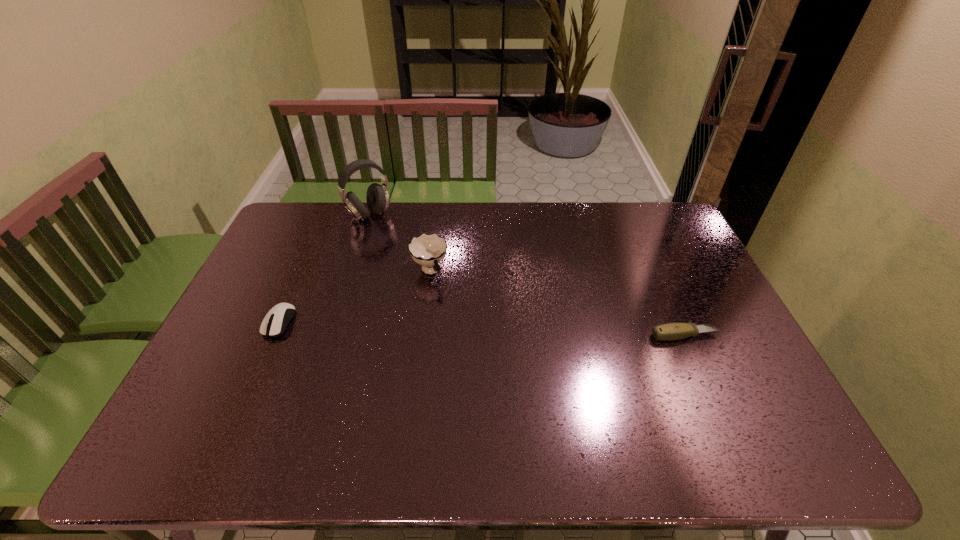
Locate an element on the screen. The width and height of the screenshot is (960, 540). free region located 0.250m on the ear cups of the headset is located at coordinates (408, 263).

You are a GUI agent. You are given a task and a screenshot of the screen. Output one action in this format:
    pyautogui.click(x=<x>, y=<y>)
    Task: Click on the vacant area situated 0.140m on the ear cups of the headset
    
    Given the screenshot: What is the action you would take?
    pyautogui.click(x=394, y=245)

At what (x,y) coordinates should I click in order to perform the action: click on free location located 0.400m on the ear cups of the headset. Please return your answer as a coordinate pair (x, y). The height and width of the screenshot is (540, 960). Looking at the image, I should click on (428, 290).

Where is `vacant space located on the side of the cup with the handle`? This screenshot has height=540, width=960. vacant space located on the side of the cup with the handle is located at coordinates (472, 342).

The image size is (960, 540). In order to click on vacant point located on the side of the cup with the handle in this screenshot , I will do `click(496, 381)`.

Identify the location of blank space located on the side of the cup with the handle. The width and height of the screenshot is (960, 540). (487, 366).

Where is `object that is at the far edge`? object that is at the far edge is located at coordinates [377, 196].

Locate an element on the screen. object that is at the left edge is located at coordinates (272, 325).

At what (x,y) coordinates should I click in order to perform the action: click on object present at the right edge. Please return your answer as a coordinate pair (x, y). This screenshot has width=960, height=540. Looking at the image, I should click on (671, 331).

This screenshot has width=960, height=540. In the image, there is a desktop. In order to click on vacant space at the far edge in this screenshot , I will do `click(572, 237)`.